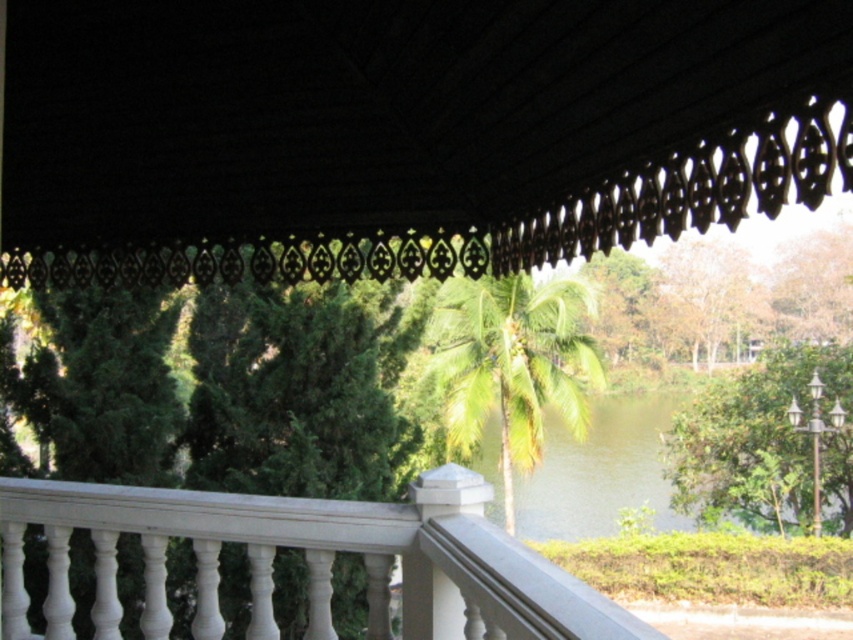
Question: Which object appears farthest from the camera in this image?

Choices:
 (A) green leafy tree at center
 (B) green leafy tree at right
 (C) white glossy railing at center

Answer: (B)

Question: Is green leafy tree at center above green leafy tree at upper right?

Choices:
 (A) no
 (B) yes

Answer: (A)

Question: Can you confirm if green leafy palm at center is thinner than green leafy tree at upper right?

Choices:
 (A) no
 (B) yes

Answer: (A)

Question: Among these objects, which one is nearest to the camera?

Choices:
 (A) green leafy palm at center
 (B) green leafy tree at upper right
 (C) green leafy tree at center

Answer: (C)

Question: Which point appears closest to the camera in this image?

Choices:
 (A) (833, 513)
 (B) (833, 256)
 (C) (303, 353)

Answer: (C)

Question: Does white glossy railing at center have a larger size compared to green leafy tree at upper right?

Choices:
 (A) no
 (B) yes

Answer: (A)